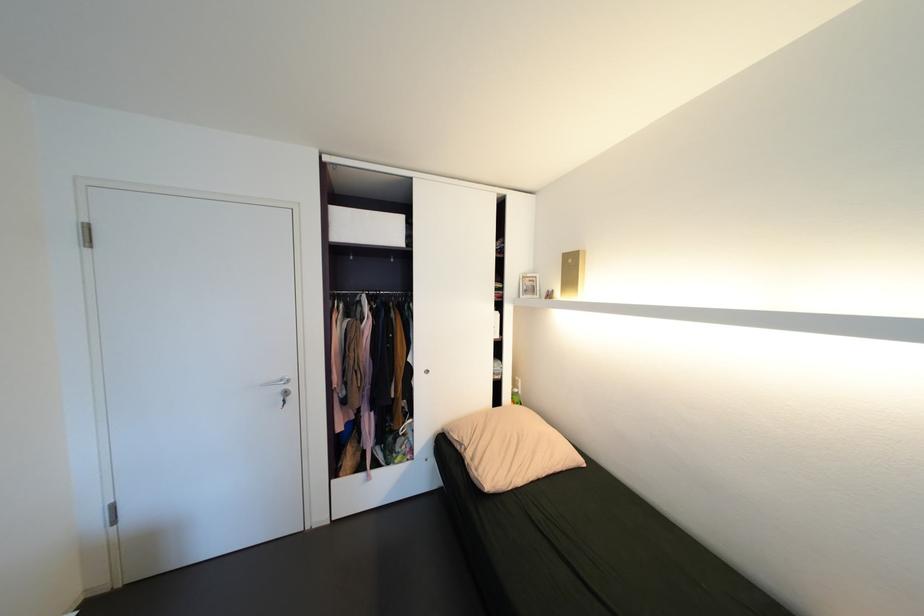
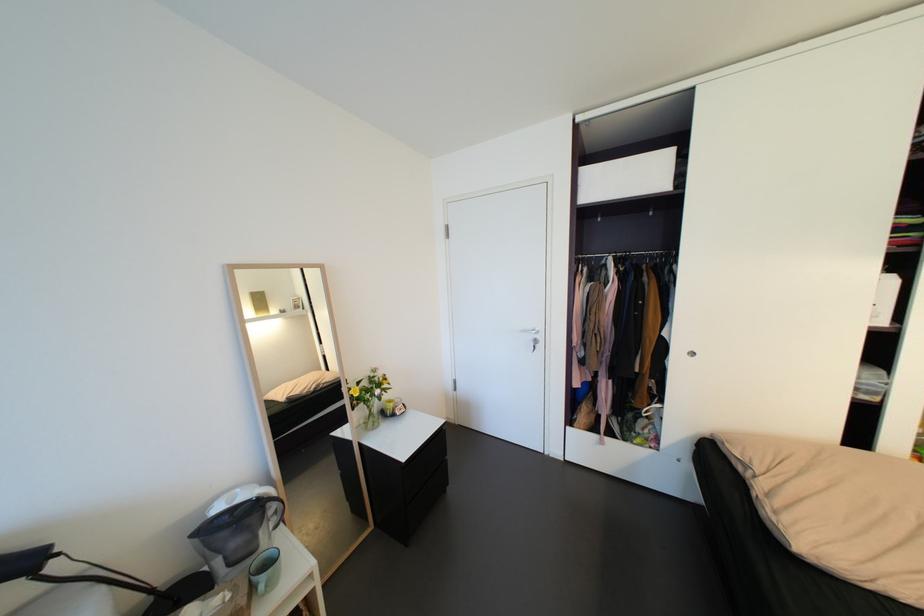
Where in the second image is the point corresponding to pixel 505 314 from the first image?

(900, 278)